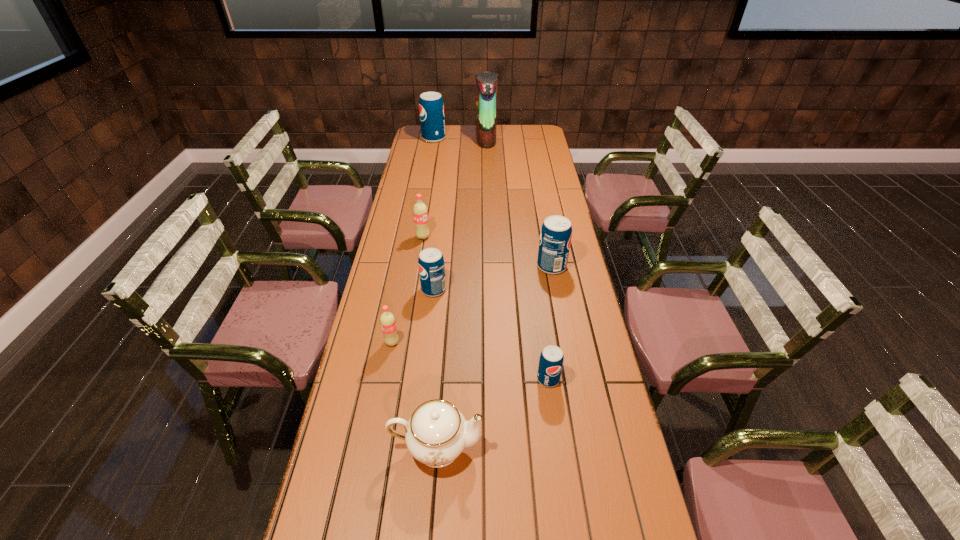
Locate an element on the screen. the fifth farthest pop is located at coordinates (387, 320).

The height and width of the screenshot is (540, 960). What are the coordinates of `the nearest object` in the screenshot? It's located at (436, 434).

Locate an element on the screen. This screenshot has width=960, height=540. the nearest pop is located at coordinates (551, 360).

You are a GUI agent. You are given a task and a screenshot of the screen. Output one action in this format:
    pyautogui.click(x=<x>, y=<y>)
    Task: Click on the shortest object
    The width and height of the screenshot is (960, 540).
    Given the screenshot: What is the action you would take?
    pyautogui.click(x=551, y=360)

At what (x,y) coordinates should I click in order to perform the action: click on vacant space located at the face of the tallest object. Please return your answer as a coordinate pair (x, y). Looking at the image, I should click on (412, 139).

You are a GUI agent. You are given a task and a screenshot of the screen. Output one action in this format:
    pyautogui.click(x=<x>, y=<y>)
    Task: Click on the free location located 0.130m at the face of the tallest object
    The width and height of the screenshot is (960, 540).
    Given the screenshot: What is the action you would take?
    pyautogui.click(x=451, y=139)

At what (x,y) coordinates should I click in order to perform the action: click on free space located 0.280m at the face of the tallest object. Please return your answer as a coordinate pair (x, y). The image size is (960, 540). Looking at the image, I should click on (424, 139).

Image resolution: width=960 pixels, height=540 pixels. Identify the location of free space located 0.170m on the front of the farthest blue pop. (430, 159).

Locate an element on the screen. The height and width of the screenshot is (540, 960). vacant space located on the back of the fifth nearest object is located at coordinates (540, 202).

At what (x,y) coordinates should I click in order to perform the action: click on vacant area situated on the right of the farther red soda. Please return your answer as a coordinate pair (x, y). Looking at the image, I should click on [443, 237].